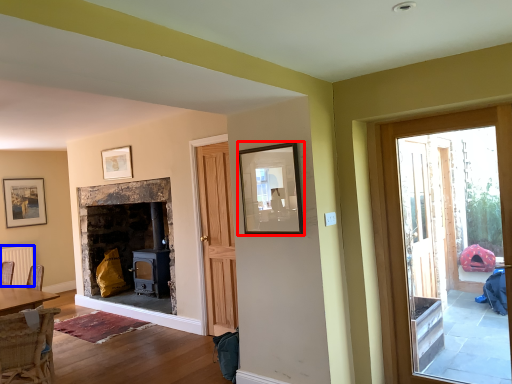
Question: Among these objects, which one is farthest to the camera, picture frame (highlighted by a red box) or radiator (highlighted by a blue box)?

Choices:
 (A) picture frame
 (B) radiator

Answer: (B)